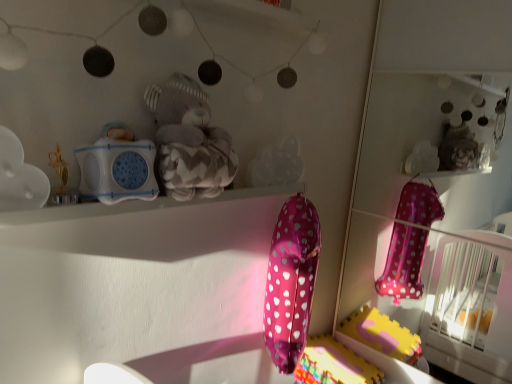
Question: From the image's perspective, would you say white matte cloud at upper left, the 1th toy from the left, is shown under translucent plastic cloud at center, which appears as the first toy when viewed from the right?

Choices:
 (A) yes
 (B) no

Answer: (A)

Question: Could you tell me if white matte cloud at upper left, which is counted as the 4th toy, starting from the right, is facing translucent plastic cloud at center, which appears as the first toy when viewed from the right?

Choices:
 (A) yes
 (B) no

Answer: (B)

Question: Considering the relative sizes of white matte cloud at upper left, the 1th toy from the left, and translucent plastic cloud at center, which is the fourth toy in left-to-right order, in the image provided, is white matte cloud at upper left, the 1th toy from the left, wider than translucent plastic cloud at center, which is the fourth toy in left-to-right order,?

Choices:
 (A) yes
 (B) no

Answer: (A)

Question: Considering the relative positions of white matte cloud at upper left, the 1th toy from the left, and translucent plastic cloud at center, which appears as the first toy when viewed from the right, in the image provided, is white matte cloud at upper left, the 1th toy from the left, in front of translucent plastic cloud at center, which appears as the first toy when viewed from the right,?

Choices:
 (A) no
 (B) yes

Answer: (B)

Question: From a real-world perspective, does white matte cloud at upper left, which is counted as the 4th toy, starting from the right, sit lower than translucent plastic cloud at center, which is the fourth toy in left-to-right order?

Choices:
 (A) yes
 (B) no

Answer: (B)

Question: Would you say white matte cloud at upper left, the 1th toy from the left, is a long distance from translucent plastic cloud at center, which is the fourth toy in left-to-right order?

Choices:
 (A) no
 (B) yes

Answer: (A)

Question: From a real-world perspective, is pink polka dot balloon at lower center located beneath white plastic speaker at upper center, which is counted as the 2th toy, starting from the left?

Choices:
 (A) no
 (B) yes

Answer: (B)

Question: From a real-world perspective, is pink polka dot balloon at lower center positioned over white plastic speaker at upper center, which is the 3th toy in right-to-left order, based on gravity?

Choices:
 (A) yes
 (B) no

Answer: (B)

Question: Does pink polka dot balloon at lower center contain white plastic speaker at upper center, which is the 3th toy in right-to-left order?

Choices:
 (A) no
 (B) yes

Answer: (A)

Question: From the image's perspective, is pink polka dot balloon at lower center located beneath white plastic speaker at upper center, which is the 3th toy in right-to-left order?

Choices:
 (A) yes
 (B) no

Answer: (A)

Question: Does pink polka dot balloon at lower center have a greater width compared to white plastic speaker at upper center, which is the 3th toy in right-to-left order?

Choices:
 (A) yes
 (B) no

Answer: (A)

Question: Does pink polka dot balloon at lower center lie behind white plastic speaker at upper center, which is the 3th toy in right-to-left order?

Choices:
 (A) yes
 (B) no

Answer: (A)

Question: Is white matte cloud at upper left, the 1th toy from the left, inside gray plush teddy bear at upper center, the second toy when ordered from right to left?

Choices:
 (A) no
 (B) yes

Answer: (A)